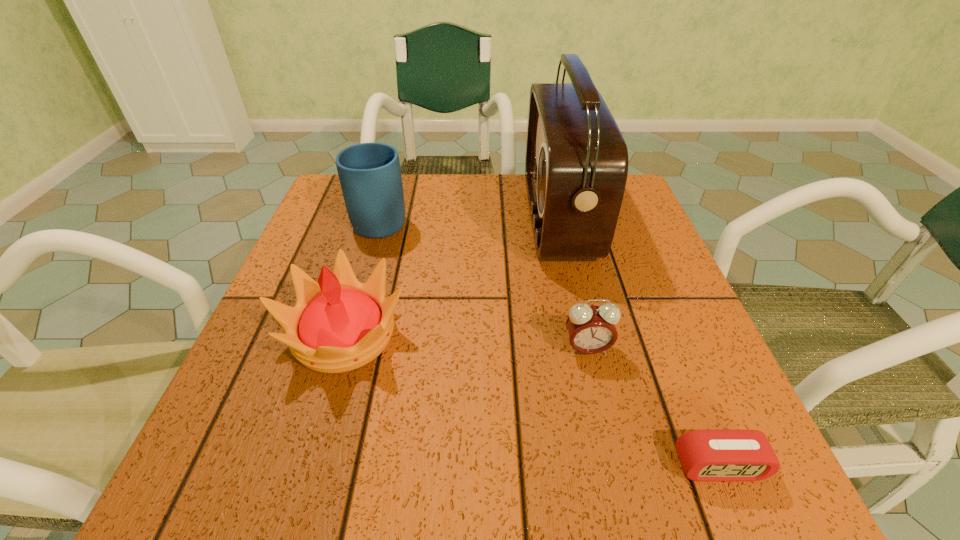
In order to click on free space between the left alarm clock and the tallest object in this screenshot , I will do `click(572, 283)`.

Find the location of `free space between the nearer alarm clock and the mug`. free space between the nearer alarm clock and the mug is located at coordinates (550, 342).

You are a GUI agent. You are given a task and a screenshot of the screen. Output one action in this format:
    pyautogui.click(x=<x>, y=<y>)
    Task: Click on the empty space that is in between the left alarm clock and the tallest object
    This screenshot has width=960, height=540.
    Given the screenshot: What is the action you would take?
    pyautogui.click(x=572, y=283)

The height and width of the screenshot is (540, 960). I want to click on free point between the second shortest object and the crown, so click(x=466, y=342).

Find the location of a particular element. Image resolution: width=960 pixels, height=540 pixels. free space between the shortest object and the radio receiver is located at coordinates (638, 341).

This screenshot has height=540, width=960. I want to click on unoccupied position between the crown and the tallest object, so click(x=451, y=275).

Image resolution: width=960 pixels, height=540 pixels. Find the location of `unoccupied area between the nearer alarm clock and the fourth tallest object`. unoccupied area between the nearer alarm clock and the fourth tallest object is located at coordinates (653, 408).

What are the coordinates of `vacant space in between the farther alarm clock and the mug` in the screenshot? It's located at (484, 284).

I want to click on free space between the mug and the shorter alarm clock, so (550, 342).

Find the location of `object that is the fourth closest to the crown`. object that is the fourth closest to the crown is located at coordinates (706, 455).